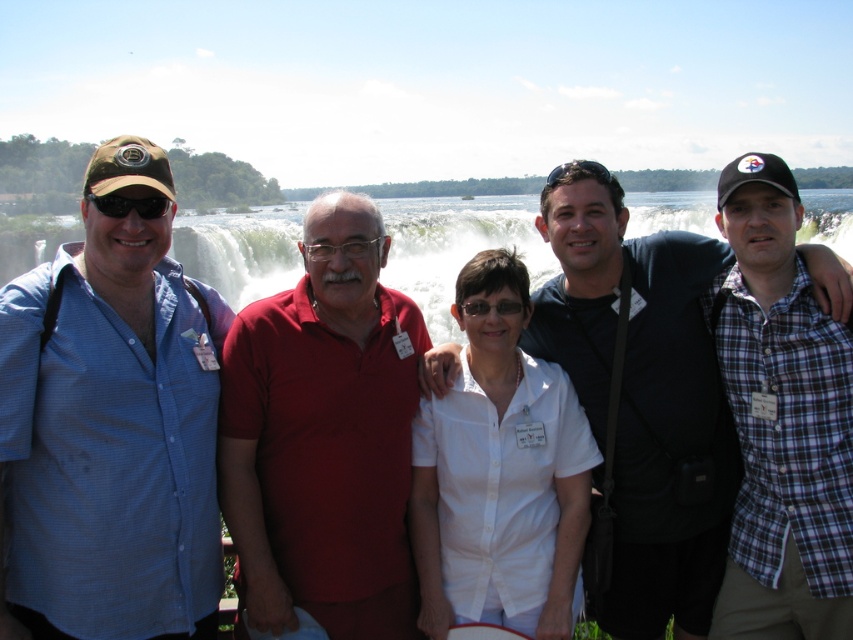
You are a photographer trying to adjust the focus on your camera. The plaid cotton shirt at right and the white matte shirt at center are both in the frame. Which shirt should you focus on first if you want to ensure the larger one is sharp?

The plaid cotton shirt at right is bigger than the white matte shirt at center, so you should focus on the plaid cotton shirt at right first to ensure it is sharp.

You are a photographer trying to adjust the focus of your camera to capture both the plaid cotton shirt at right and the white matte shirt at center clearly. Based on their positions, which shirt should you focus on first to ensure both are in focus?

The plaid cotton shirt at right is above the white matte shirt at center, so focusing on the plaid cotton shirt at right first will ensure both are in focus as they are vertically aligned.